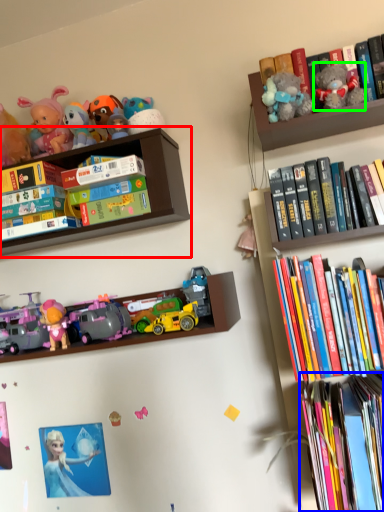
Question: Which is nearer to the shelf (highlighted by a red box)? book (highlighted by a blue box) or toy (highlighted by a green box).

Choices:
 (A) book
 (B) toy

Answer: (B)